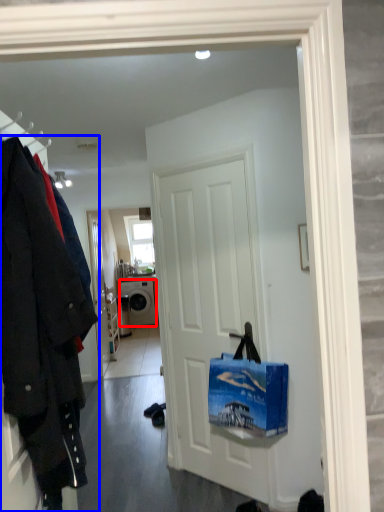
Question: Which point is closer to the camera, washing machine (highlighted by a red box) or coat (highlighted by a blue box)?

Choices:
 (A) washing machine
 (B) coat

Answer: (B)